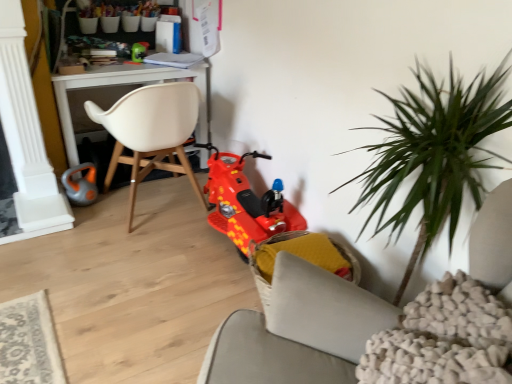
The image size is (512, 384). In order to click on free location in front of green plastic toy at upper center, the second toy positioned from the left in this screenshot , I will do `click(131, 67)`.